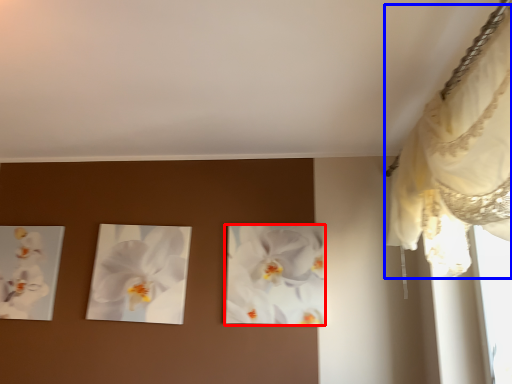
Question: Which object appears farthest to the camera in this image, flower (highlighted by a red box) or curtain (highlighted by a blue box)?

Choices:
 (A) flower
 (B) curtain

Answer: (A)